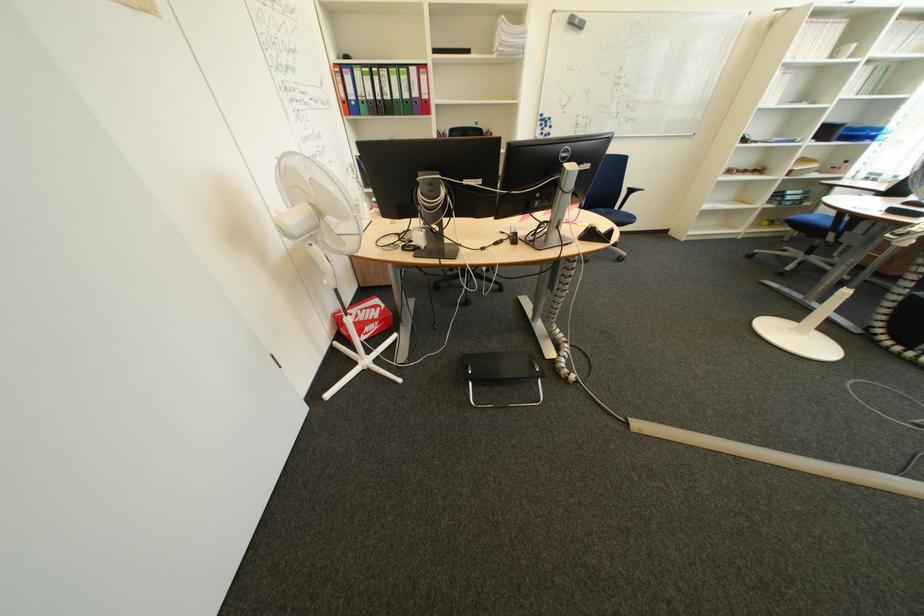
What do you see at coordinates (366, 318) in the screenshot?
I see `a red binder finger hole` at bounding box center [366, 318].